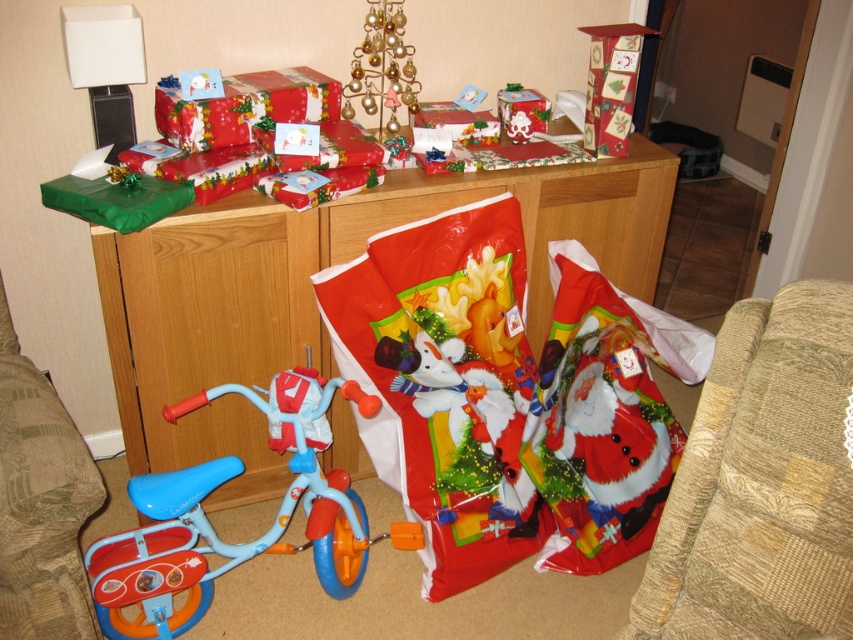
Who is lower down, light blue plastic bicycle at lower left or textured beige armchair at lower left?

light blue plastic bicycle at lower left is lower down.

Is light blue plastic bicycle at lower left thinner than textured beige armchair at lower left?

No, light blue plastic bicycle at lower left is not thinner than textured beige armchair at lower left.

Is point (186, 547) positioned in front of point (49, 529)?

That is False.

Locate an element on the screen. light blue plastic bicycle at lower left is located at coordinates (235, 544).

Who is more distant from viewer, (x=773, y=540) or (x=305, y=486)?

Positioned behind is point (x=305, y=486).

Is point (666, 556) more distant than point (329, 387)?

No.

Where is `beige fabric armchair at lower right`? beige fabric armchair at lower right is located at coordinates (762, 481).

Which is below, wooden cabinet at center or textured beige armchair at lower left?

textured beige armchair at lower left is below.

Who is more forward, (564, 196) or (84, 467)?

Positioned in front is point (84, 467).

Which is behind, point (508, 182) or point (21, 490)?

The point (508, 182) is more distant.

Where is `wooden cabinet at center`? Image resolution: width=853 pixels, height=640 pixels. wooden cabinet at center is located at coordinates (312, 292).